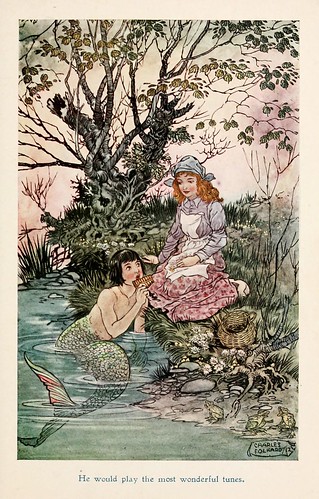
Image resolution: width=319 pixels, height=499 pixels. I want to click on woven basket, so click(x=223, y=330).